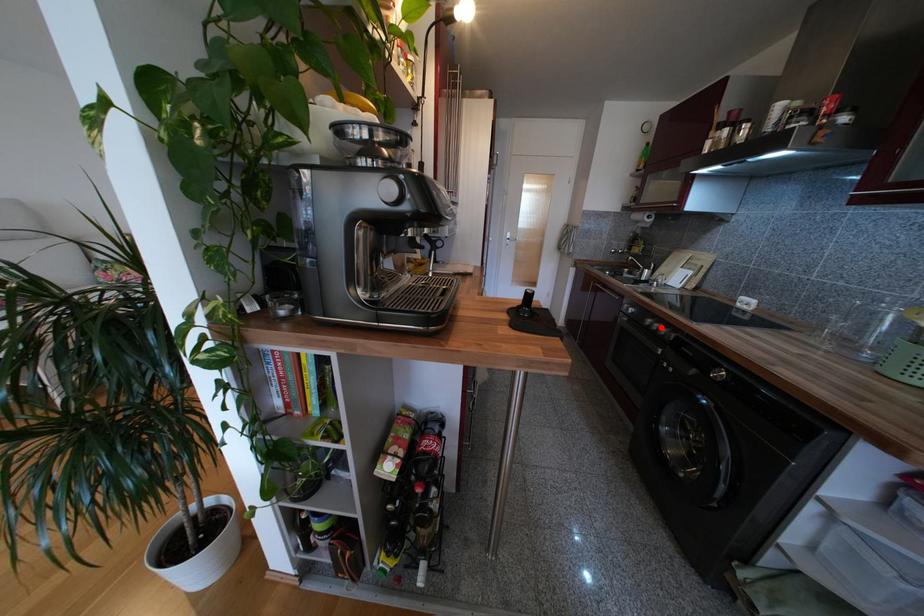
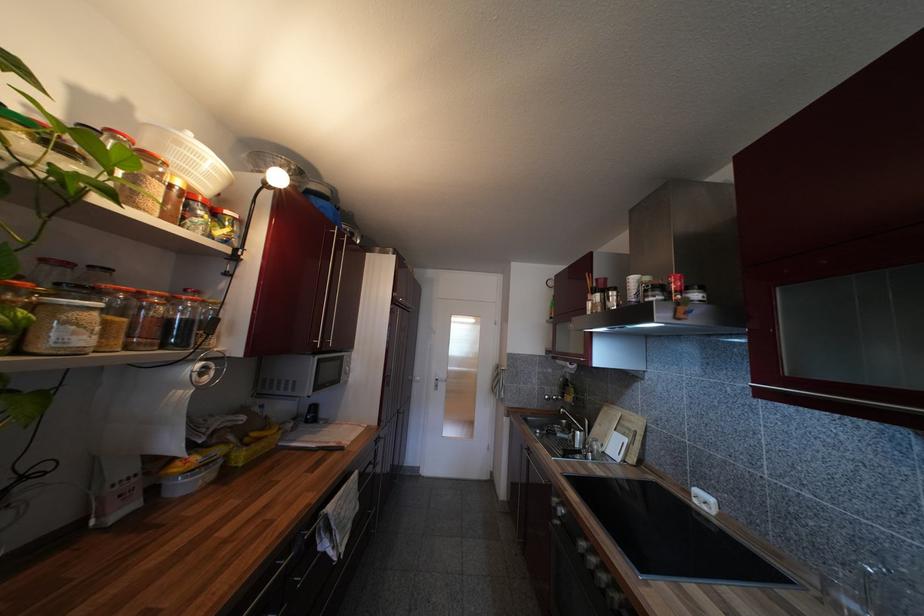
Locate, in the second image, the point that corresponds to the highlighted location in the first image.

(597, 562)